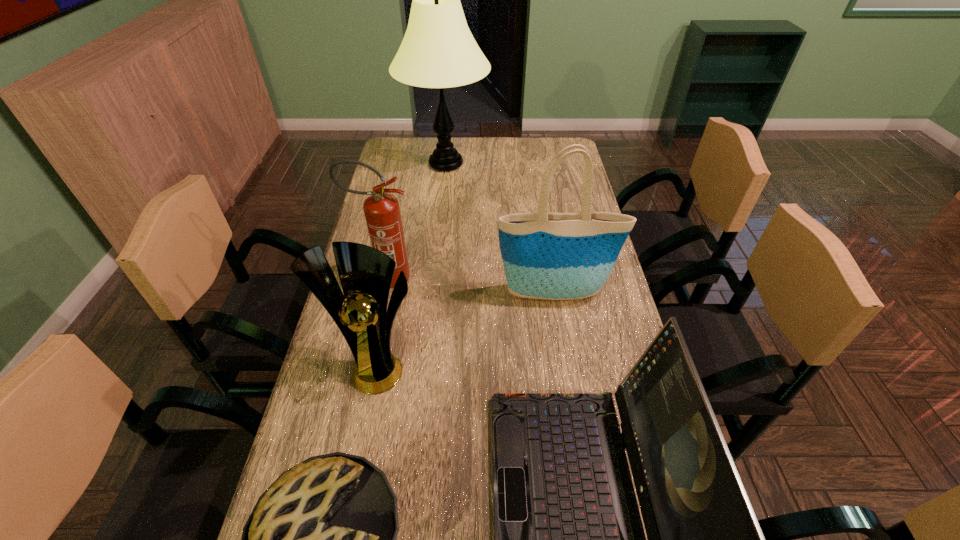
The height and width of the screenshot is (540, 960). What are the coordinates of `lamp located at the left edge` in the screenshot? It's located at (438, 50).

Where is `fire extinguisher at the left edge`? fire extinguisher at the left edge is located at coordinates (382, 213).

Locate an element on the screen. Image resolution: width=960 pixels, height=540 pixels. award positioned at the left edge is located at coordinates (361, 314).

Locate an element on the screen. Image resolution: width=960 pixels, height=540 pixels. object at the right edge is located at coordinates (556, 256).

In order to click on object present at the far left corner in this screenshot , I will do click(438, 50).

Find the location of a particular element. Image resolution: width=960 pixels, height=540 pixels. free spot at the far edge of the desktop is located at coordinates (528, 161).

Image resolution: width=960 pixels, height=540 pixels. Find the location of `free space at the right edge of the desktop`. free space at the right edge of the desktop is located at coordinates (556, 194).

This screenshot has width=960, height=540. I want to click on vacant space at the far right corner, so click(534, 147).

Find the location of `vacant region between the tallest object and the fire extinguisher`. vacant region between the tallest object and the fire extinguisher is located at coordinates (417, 221).

Image resolution: width=960 pixels, height=540 pixels. I want to click on vacant space that is in between the lamp and the award, so click(x=412, y=264).